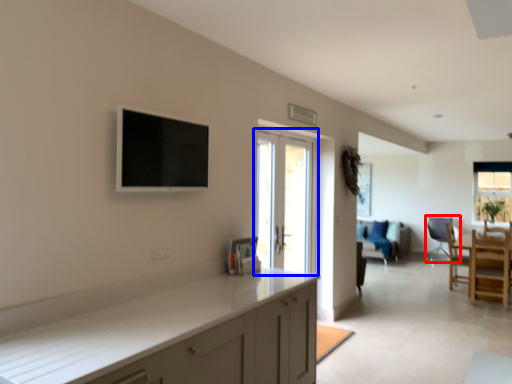
Question: Which object is closer to the camera taking this photo, chair (highlighted by a red box) or door (highlighted by a blue box)?

Choices:
 (A) chair
 (B) door

Answer: (B)